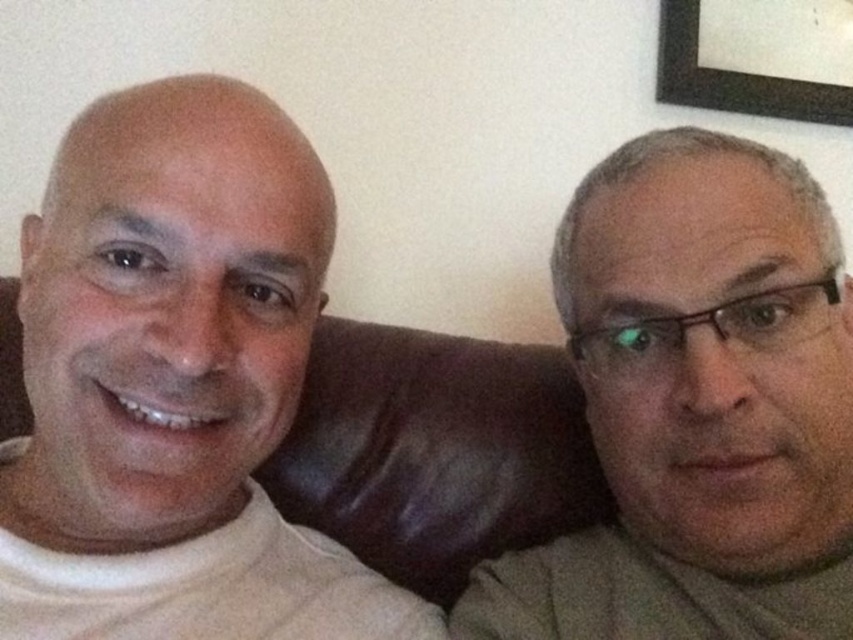
Between white matte t-shirt at left and black matte picture frame at upper right, which one appears on the right side from the viewer's perspective?

black matte picture frame at upper right

Describe the element at coordinates (173, 384) in the screenshot. I see `white matte t-shirt at left` at that location.

Find the location of `white matte t-shirt at left`. white matte t-shirt at left is located at coordinates (173, 384).

Can you confirm if gray matte glasses at right is thinner than black matte picture frame at upper right?

Yes, gray matte glasses at right is thinner than black matte picture frame at upper right.

Who is more distant from viewer, (712, 266) or (814, 106)?

The point (814, 106) is behind.

Is point (648, 256) behind point (795, 92)?

No, it is not.

The width and height of the screenshot is (853, 640). In order to click on gray matte glasses at right in this screenshot , I will do `click(697, 406)`.

Does white matte t-shirt at left have a greater height compared to gray matte glasses at right?

Correct, white matte t-shirt at left is much taller as gray matte glasses at right.

Is point (218, 272) closer to viewer compared to point (790, 390)?

Yes, it is in front of point (790, 390).

Describe the element at coordinates (173, 384) in the screenshot. The width and height of the screenshot is (853, 640). I see `white matte t-shirt at left` at that location.

Locate an element on the screen. white matte t-shirt at left is located at coordinates (173, 384).